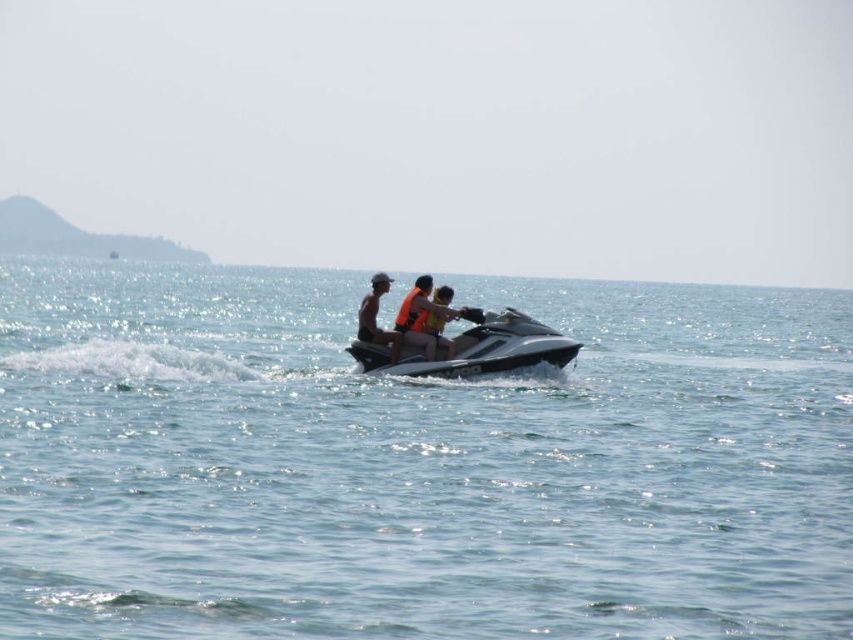
Question: Which object is the farthest from the tan skin person at center?

Choices:
 (A) orange life vest at center
 (B) matte orange life vest at center
 (C) clear blue water at center

Answer: (C)

Question: Which point appears farthest from the camera in this image?

Choices:
 (A) (404, 308)
 (B) (369, 292)
 (C) (466, 349)

Answer: (B)

Question: Does tan skin person at center appear over orange life vest at center?

Choices:
 (A) no
 (B) yes

Answer: (B)

Question: Estimate the real-world distances between objects in this image. Which object is closer to the orange life jacket at center?

Choices:
 (A) orange life vest at center
 (B) silver metallic jet ski at center

Answer: (A)

Question: Can you confirm if silver metallic jet ski at center is positioned below tan skin person at center?

Choices:
 (A) no
 (B) yes

Answer: (B)

Question: Is clear blue water at center positioned at the back of orange life jacket at center?

Choices:
 (A) no
 (B) yes

Answer: (A)